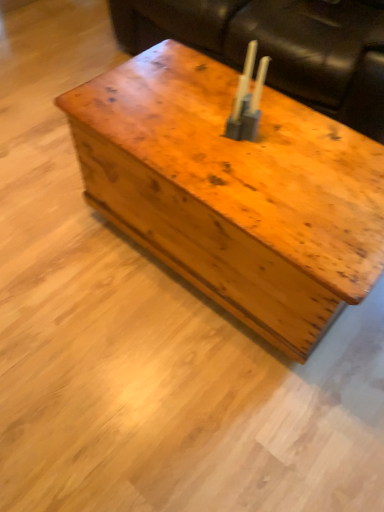
Locate an element on the screen. Image resolution: width=384 pixels, height=512 pixels. free spot to the left of metallic silver candle holder at center is located at coordinates (182, 132).